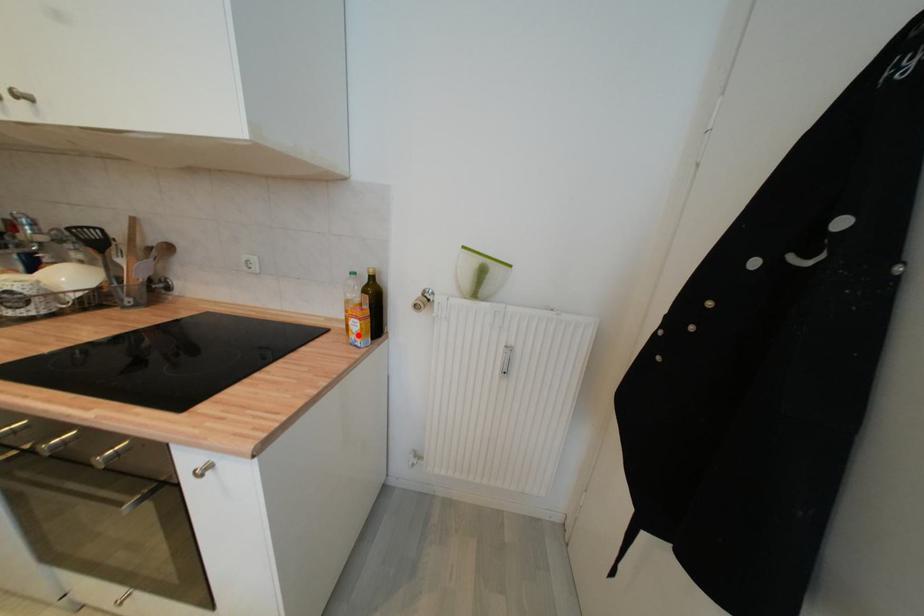
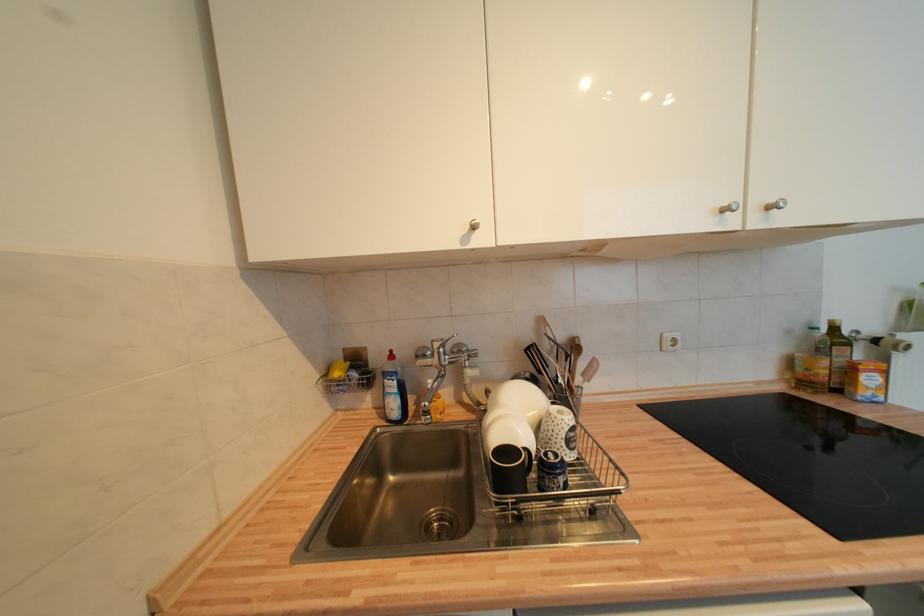
Question: I am providing you with two images of the same scene from different viewpoints. Given a red point in image1, look at the same physical point in image2. Is it:

Choices:
 (A) Closer to the viewpoint
 (B) Farther from the viewpoint

Answer: (A)